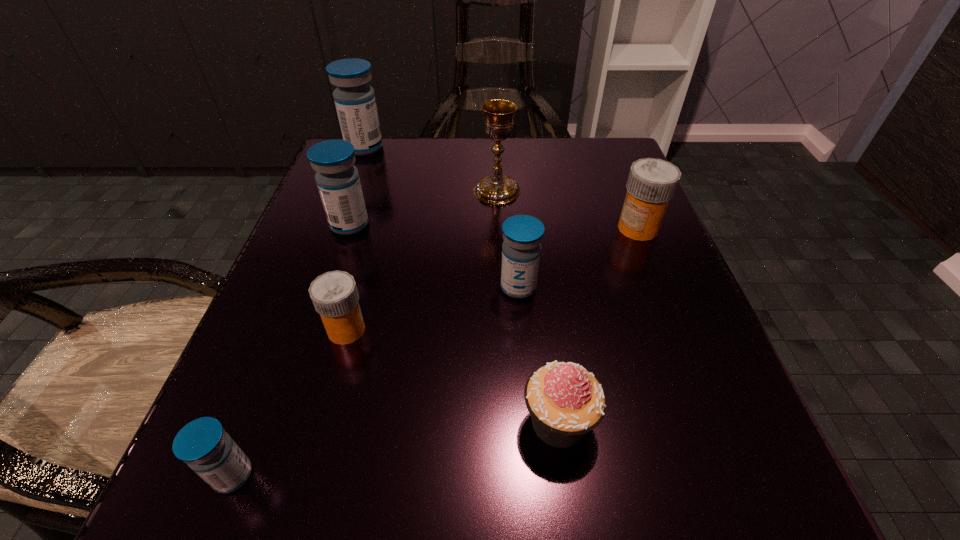
I want to click on blank region between the chalice and the nearest blue medicine, so click(x=365, y=333).

Identify the location of free space that is in between the nearest blue medicine and the right orange medicine. (436, 352).

Find the location of `vacant area that lies between the cupcake and the nearer orange medicine`. vacant area that lies between the cupcake and the nearer orange medicine is located at coordinates (452, 376).

The image size is (960, 540). In order to click on free space between the smaller orange medicine and the tallest medicine in this screenshot , I will do `click(355, 239)`.

Find the location of a particular element. This screenshot has height=540, width=960. free point between the smallest blue medicine and the third tallest object is located at coordinates (291, 350).

This screenshot has width=960, height=540. Identify the location of free area in between the farthest medicine and the cupcake. (462, 285).

Locate which object ranks third in proximity to the second farthest blue medicine. Please provide its 2D coordinates. Your answer should be formatted as a tuple, i.e. [(x, y)], where the tuple contains the x and y coordinates of a point satisfying the conditions above.

[(355, 102)]

Identify which object is the second nearest to the nearest medicine. Please provide its 2D coordinates. Your answer should be formatted as a tuple, i.e. [(x, y)], where the tuple contains the x and y coordinates of a point satisfying the conditions above.

[(566, 401)]

Identify which medicine is the second closest to the cupcake. Please provide its 2D coordinates. Your answer should be formatted as a tuple, i.e. [(x, y)], where the tuple contains the x and y coordinates of a point satisfying the conditions above.

[(334, 294)]

Identify which medicine is located as the nearest to the sixth shortest object. Please provide its 2D coordinates. Your answer should be formatted as a tuple, i.e. [(x, y)], where the tuple contains the x and y coordinates of a point satisfying the conditions above.

[(334, 294)]